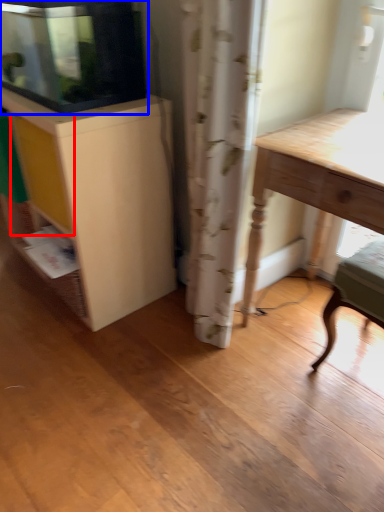
Question: Which point is further to the camera, drawer (highlighted by a red box) or cabinetry (highlighted by a blue box)?

Choices:
 (A) drawer
 (B) cabinetry

Answer: (A)